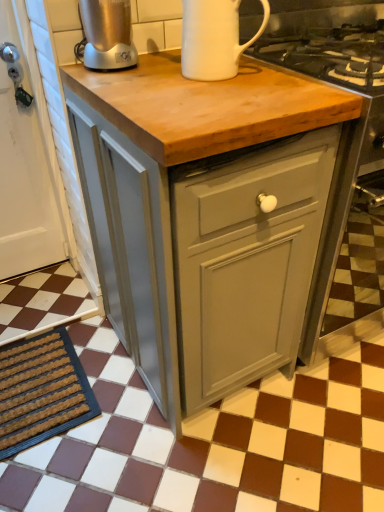
Locate an element on the screen. The height and width of the screenshot is (512, 384). vacant area that is in front of brown textured mat at lower left is located at coordinates (64, 472).